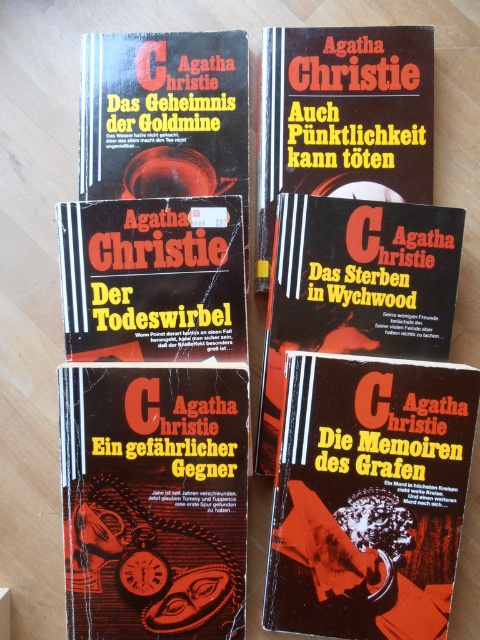
You are designing a promotional display for these books and need to place a dark red paper at center and a black matte book cover at center on a shelf. Which object should you place first to ensure the larger one is visible?

The dark red paper at center is bigger than the black matte book cover at center, so you should place the dark red paper at center first to ensure it is visible.

You have a small sticker that is 2 cm wide. You want to place it on either the dark red paper at center or the black matte book cover at center. Which surface will allow the sticker to fit without overlapping its edges?

The dark red paper at center has a greater width than the black matte book cover at center, so the sticker will fit better on the dark red paper at center without overlapping edges.